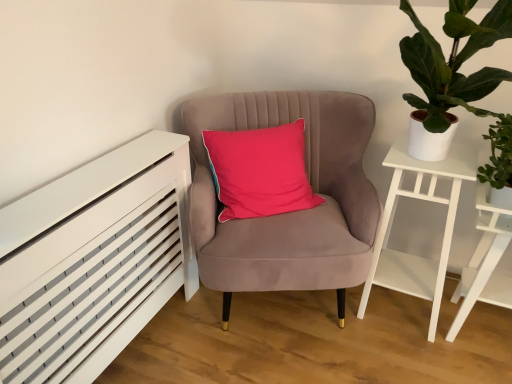
Where is `free space to the left of white matte side table at right`? free space to the left of white matte side table at right is located at coordinates (x=334, y=326).